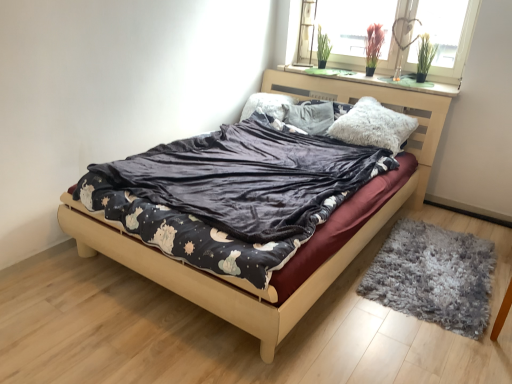
Question: Considering the relative positions of fluffy white pillow at center, the 2th pillow from the back, and glass window at upper right in the image provided, is fluffy white pillow at center, the 2th pillow from the back, to the left of glass window at upper right from the viewer's perspective?

Choices:
 (A) no
 (B) yes

Answer: (B)

Question: From the image's perspective, is fluffy white pillow at center, the 2th pillow positioned from the left, over glass window at upper right?

Choices:
 (A) yes
 (B) no

Answer: (B)

Question: Is fluffy white pillow at center, the 2th pillow positioned from the left, turned away from glass window at upper right?

Choices:
 (A) yes
 (B) no

Answer: (B)

Question: Is fluffy white pillow at center, which ranks as the first pillow in front-to-back order, smaller than glass window at upper right?

Choices:
 (A) yes
 (B) no

Answer: (A)

Question: Is fluffy white pillow at center, the 2th pillow from the back, taller than glass window at upper right?

Choices:
 (A) yes
 (B) no

Answer: (B)

Question: Is fluffy white pillow at center, the 2th pillow from the back, positioned in front of glass window at upper right?

Choices:
 (A) no
 (B) yes

Answer: (B)

Question: From a real-world perspective, is fluffy white pillow at center, the 2th pillow positioned from the left, positioned over gray shaggy rug at lower right based on gravity?

Choices:
 (A) no
 (B) yes

Answer: (B)

Question: Is fluffy white pillow at center, the 2th pillow positioned from the left, bigger than gray shaggy rug at lower right?

Choices:
 (A) yes
 (B) no

Answer: (A)

Question: Is fluffy white pillow at center, the first pillow from the right, smaller than gray shaggy rug at lower right?

Choices:
 (A) no
 (B) yes

Answer: (A)

Question: Can you see fluffy white pillow at center, which ranks as the first pillow in front-to-back order, touching gray shaggy rug at lower right?

Choices:
 (A) no
 (B) yes

Answer: (A)

Question: Is fluffy white pillow at center, the 2th pillow positioned from the left, completely or partially outside of gray shaggy rug at lower right?

Choices:
 (A) no
 (B) yes

Answer: (B)

Question: Does fluffy white pillow at center, the 2th pillow from the back, appear on the right side of gray shaggy rug at lower right?

Choices:
 (A) yes
 (B) no

Answer: (B)

Question: Does fluffy white pillow at upper center, which is the 1th pillow from left to right, have a lesser width compared to velvet dark gray blanket at center?

Choices:
 (A) no
 (B) yes

Answer: (B)